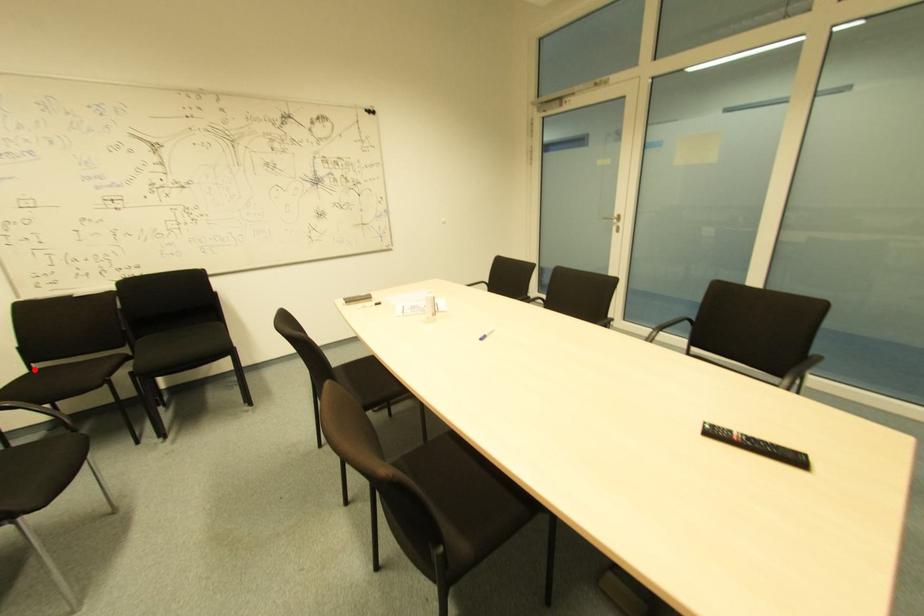
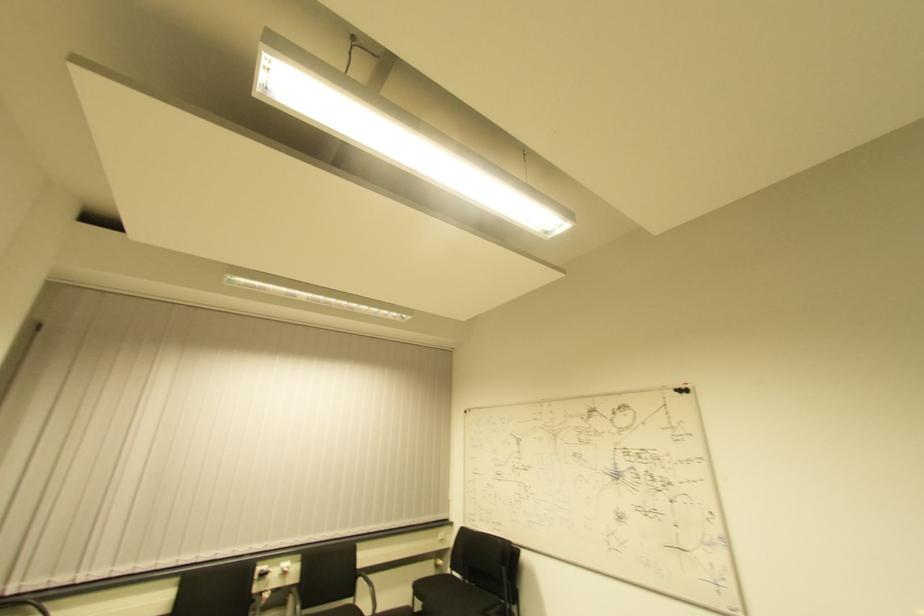
Where in the second image is the point corresponding to the highlighted location from the first image?

(454, 576)